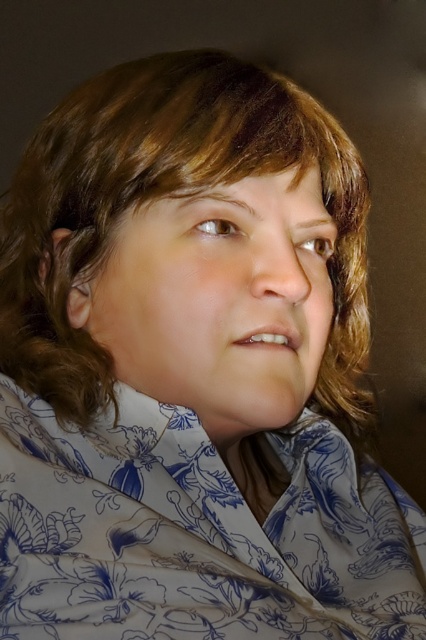
You are an interior designer creating a layout for a living room. You have a white floral fabric at center that needs to be placed on a couch. The couch is positioned at the lower left corner of the room. Based on the coordinates provided, will the fabric be centered on the couch?

The white floral fabric at center is located at coordinates point (195, 532), which is closer to the right side of the room. Since the couch is at the lower left corner, placing the fabric at this position would not center it on the couch. The fabric would be off to the right side relative to the couch.